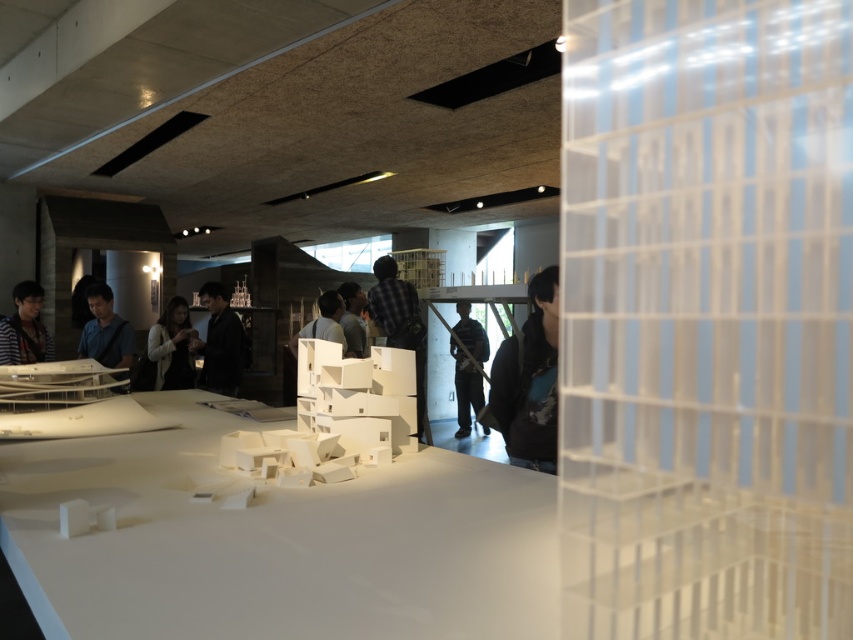
Question: Estimate the real-world distances between objects in this image. Which object is closer to the white matte mannequin at center?

Choices:
 (A) light brown leather jacket at center
 (B) dark gray shirt at center
 (C) striped shirt at left

Answer: (B)

Question: Among these points, which one is nearest to the camera?

Choices:
 (A) pyautogui.click(x=544, y=356)
 (B) pyautogui.click(x=119, y=316)
 (C) pyautogui.click(x=0, y=328)
 (D) pyautogui.click(x=341, y=304)

Answer: (A)

Question: Can you confirm if striped shirt at left is positioned to the right of white matte mannequin at center?

Choices:
 (A) no
 (B) yes

Answer: (A)

Question: Is black matte jacket at center to the right of dark gray shirt at center from the viewer's perspective?

Choices:
 (A) no
 (B) yes

Answer: (A)

Question: Estimate the real-world distances between objects in this image. Which object is closer to the matte blue shirt at center?

Choices:
 (A) light brown leather jacket at center
 (B) white matte mannequin at center
 (C) striped shirt at left
 (D) dark blue hoodie at center

Answer: (A)

Question: From the image, what is the correct spatial relationship of light brown leather jacket at center in relation to dark gray shirt at center?

Choices:
 (A) left
 (B) right

Answer: (A)